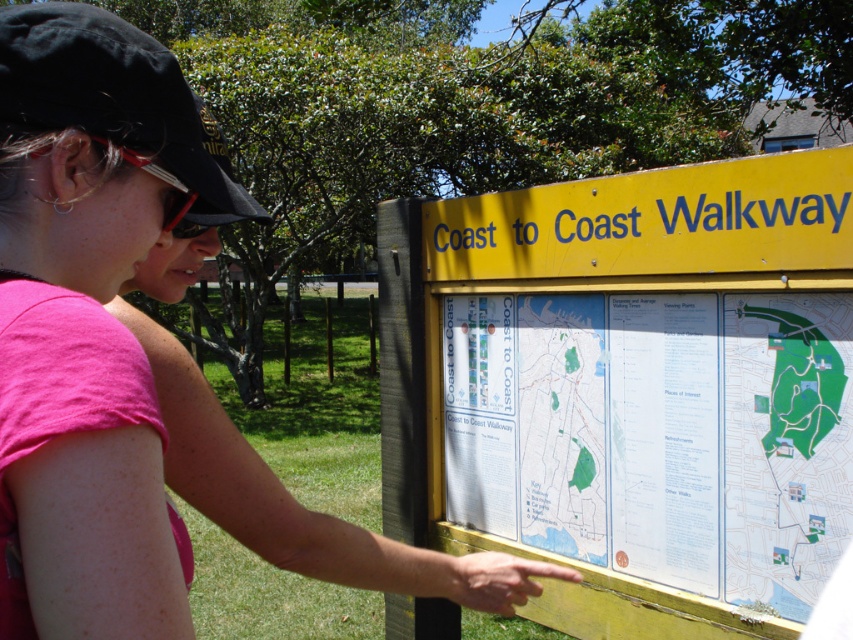
You are a fashion designer observing a person in a park. You notice the pink fabric shirt at center and the metallic red sunglasses at upper left. Which item has a greater width?

The pink fabric shirt at center has a greater width than the metallic red sunglasses at upper left.

You are a hiker trying to read the green paper map at center while standing next to the pink fabric shirt at center. Which object is shorter in height?

The green paper map at center is not as tall as the pink fabric shirt at center, so the green paper map at center is shorter in height.

You are the person in the image holding the green paper map at center and wearing the metallic red sunglasses at upper left. You want to fold the map and put it into your pocket. Which object should you move first to access the map?

You should move the metallic red sunglasses at upper left first because the green paper map at center is positioned under it, so you need to remove the sunglasses to access the map.